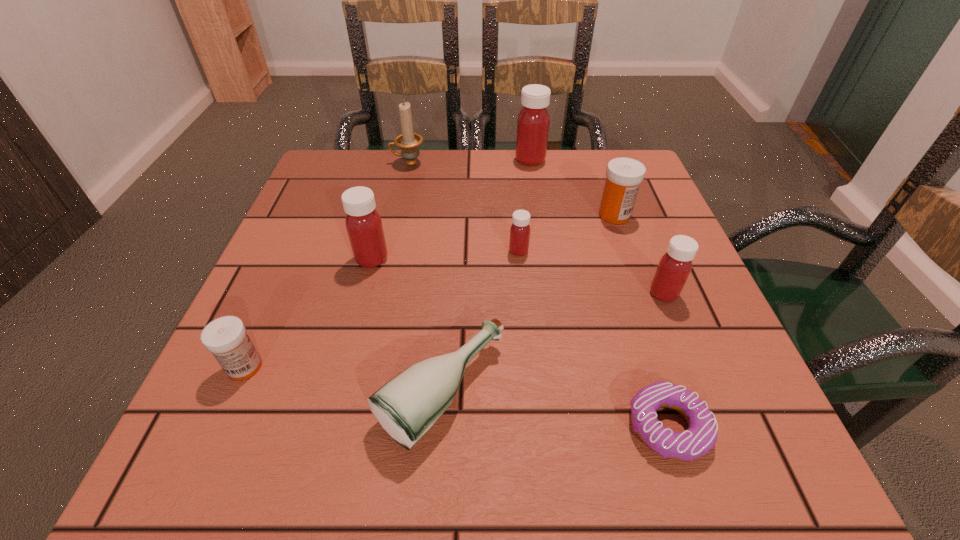
Find the location of a particular element. The width and height of the screenshot is (960, 540). object that is the fourth closest one to the smallest red medicine is located at coordinates (364, 226).

The width and height of the screenshot is (960, 540). I want to click on medicine that is the second closest to the farthest medicine, so 520,230.

Locate which medicine ranks fifth in proximity to the right white medicine. Please provide its 2D coordinates. Your answer should be formatted as a tuple, i.e. [(x, y)], where the tuple contains the x and y coordinates of a point satisfying the conditions above.

[(226, 338)]

At what (x,y) coordinates should I click in order to perform the action: click on red medicine that is the fourth closest to the bottle. Please return your answer as a coordinate pair (x, y). The image size is (960, 540). Looking at the image, I should click on (533, 122).

I want to click on red medicine that is the third nearest to the farthest medicine, so click(675, 265).

Where is `vacant region that satisfies the following two spatial constraints: 1. on the back side of the purple doughnut; 2. on the handle side of the candle_holder`? The width and height of the screenshot is (960, 540). vacant region that satisfies the following two spatial constraints: 1. on the back side of the purple doughnut; 2. on the handle side of the candle_holder is located at coordinates (585, 163).

Identify the location of vacant space that satisfies the following two spatial constraints: 1. on the handle side of the candle_holder; 2. on the right side of the smallest red medicine. (389, 251).

This screenshot has width=960, height=540. Identify the location of vacant region that satisfies the following two spatial constraints: 1. on the front side of the nearest red medicine; 2. on the right side of the fifth shortest medicine. (363, 294).

I want to click on free space that satisfies the following two spatial constraints: 1. on the front side of the doughnut; 2. on the left side of the smallest red medicine, so click(535, 426).

This screenshot has width=960, height=540. I want to click on vacant space that satisfies the following two spatial constraints: 1. on the back side of the smallest red medicine; 2. on the handle side of the candle_holder, so click(511, 163).